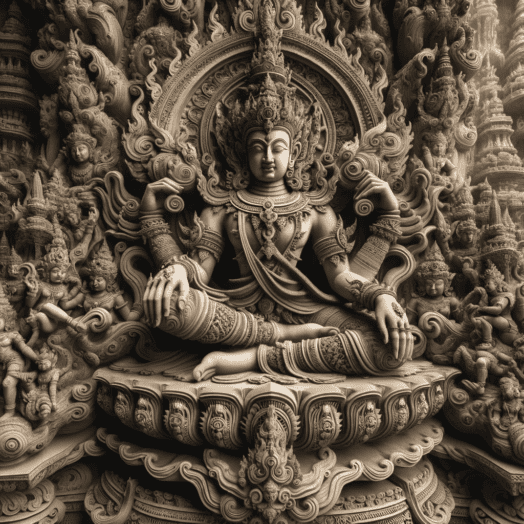
The image size is (524, 524). I want to click on pedestal, so click(x=365, y=452).